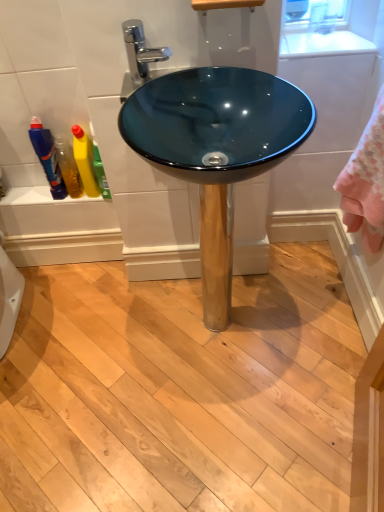
Question: From a real-world perspective, is yellow liquid at left, arranged as the second cleaning product when viewed from the left, above or below glossy glass bowl at center?

Choices:
 (A) below
 (B) above

Answer: (B)

Question: Is point (97, 158) positioned closer to the camera than point (309, 170)?

Choices:
 (A) farther
 (B) closer

Answer: (B)

Question: Which of these objects is positioned closest to the translucent plastic bottles at left?

Choices:
 (A) yellow liquid at left, arranged as the first cleaning product when viewed from the right
 (B) yellow matte bottle at left, positioned as the 2th cleaning product in right-to-left order
 (C) teal glass bowl at center
 (D) translucent plastic bottle at left
 (E) glossy glass bowl at center

Answer: (D)

Question: Estimate the real-world distances between objects in this image. Which object is closer to the chrome metallic faucet at upper center?

Choices:
 (A) translucent plastic bottle at left
 (B) teal glass bowl at center
 (C) yellow matte bottle at left, the first cleaning product in the left-to-right sequence
 (D) translucent plastic bottles at left
 (E) glossy glass bowl at center

Answer: (B)